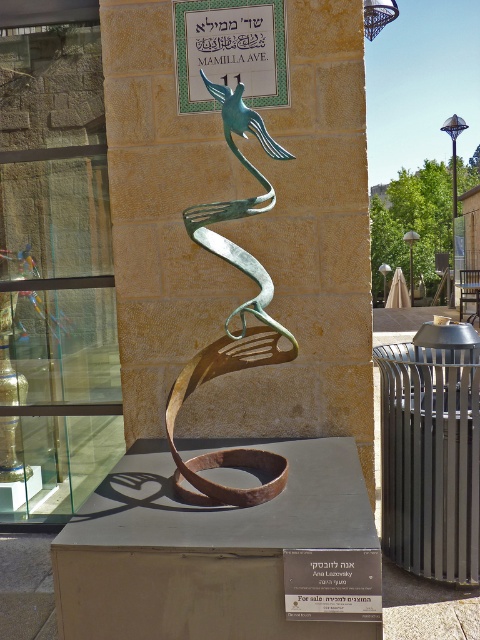
You are an art student analyzing the sculpture and its plaque. You notice both the green patina metal bird at center and the green metallic sign at upper center. Which object has a greater height?

The green patina metal bird at center is taller than the green metallic sign at upper center according to the description.

You are an artist planning to create a miniature version of the sculpture and the sign. Given that the green metallic sign at upper center is 10 cm thick, what should be the maximum thickness you can use for the green patina metal bird at center to maintain the same proportion?

Since the green patina metal bird at center is thinner than the green metallic sign at upper center, and the sign is 10 cm thick, the bird should be made thinner than 10 cm to maintain the proportion.

You are a tourist standing in front of the sculpture. You see the green patina metal bird at center and the green metallic sign at upper center. Which object is positioned to the right of the other?

The green patina metal bird at center is to the right of the green metallic sign at upper center.